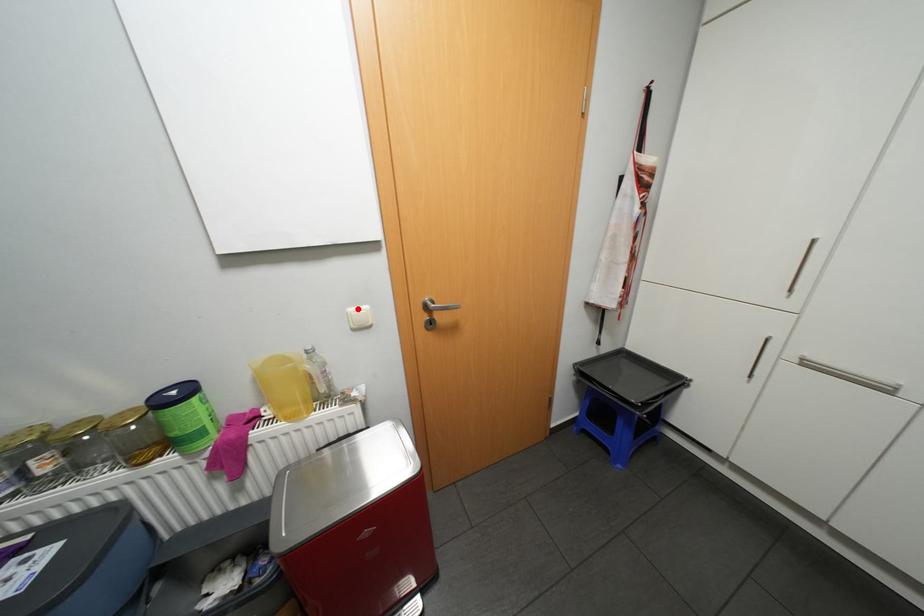
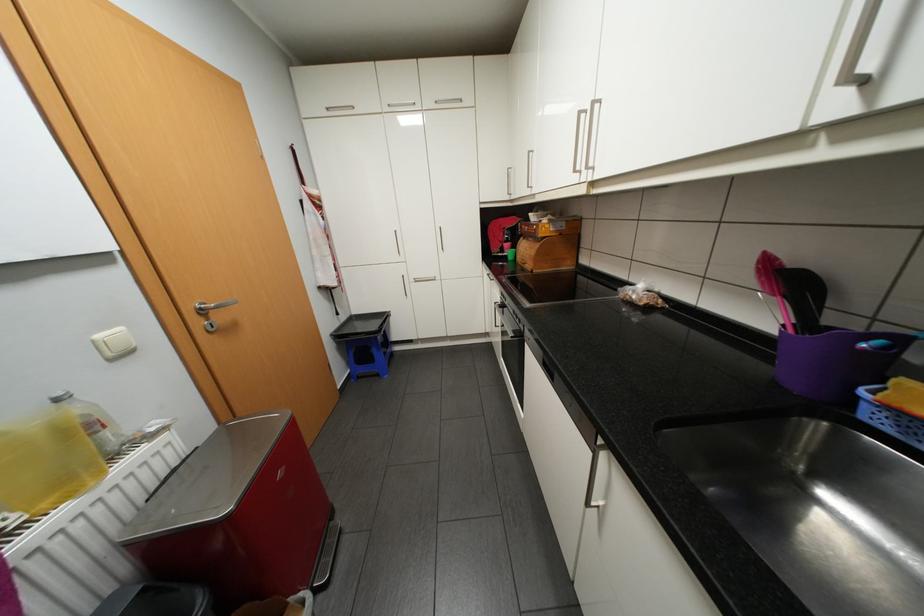
Locate, in the second image, the point that corresponds to the highlighted location in the first image.

(106, 334)